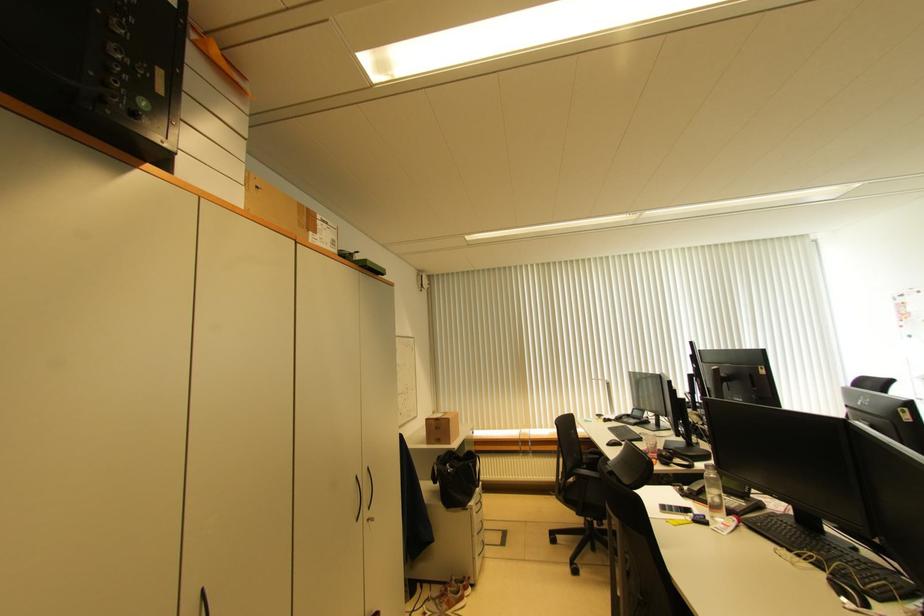
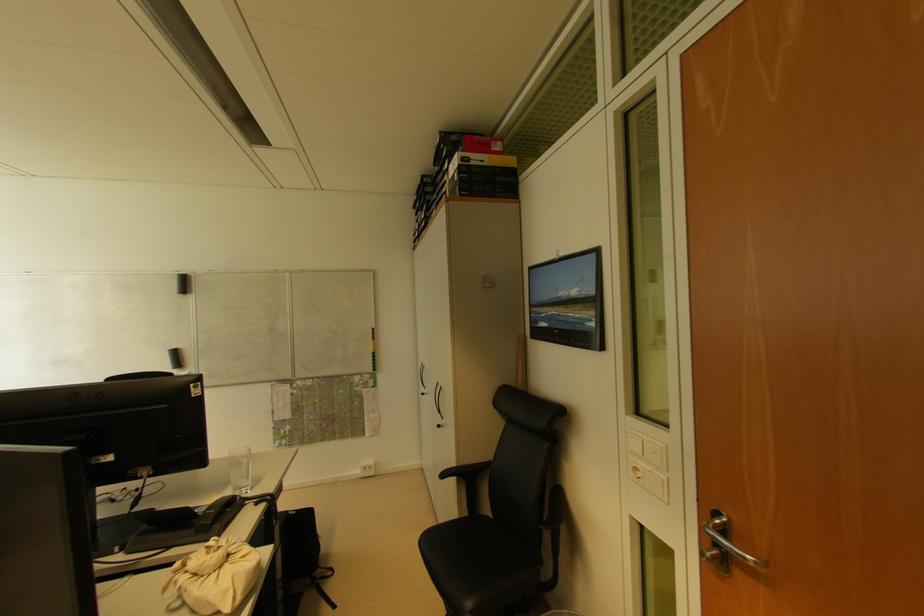
Question: The first image is from the beginning of the video and the second image is from the end. How did the camera likely rotate when shooting the video?

Choices:
 (A) Left
 (B) Right
 (C) Up
 (D) Down

Answer: (B)